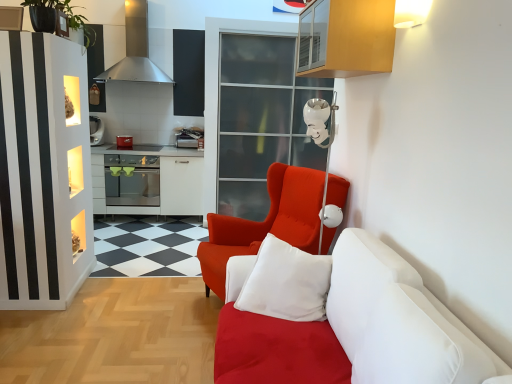
What is the approximate height of satin red armchair at center?

It is 39.01 inches.

The image size is (512, 384). What are the coordinates of `metallic oven at center-left, the second appliance when ordered from right to left` in the screenshot? It's located at (124, 141).

Describe the element at coordinates (124, 141) in the screenshot. I see `metallic oven at center-left, the second appliance when ordered from right to left` at that location.

Identify the location of satin silver oven at center. The image size is (512, 384). (132, 180).

This screenshot has height=384, width=512. In order to click on transparent glass door at upper center in this screenshot , I will do `click(261, 119)`.

Looking at this image, would you consider wooden cabinet at upper right to be distant from stainless steel exhaust hood at upper left?

Yes.

Would you say stainless steel exhaust hood at upper left is part of wooden cabinet at upper right's contents?

No, stainless steel exhaust hood at upper left is not a part of wooden cabinet at upper right.

Measure the distance between wooden cabinet at upper right and stainless steel exhaust hood at upper left.

wooden cabinet at upper right and stainless steel exhaust hood at upper left are 2.82 meters apart from each other.

Is wooden cabinet at upper right looking in the opposite direction of stainless steel exhaust hood at upper left?

No, wooden cabinet at upper right is not facing the opposite direction of stainless steel exhaust hood at upper left.

From the image's perspective, count 2nd appliances upward from the white fabric couch at lower right and point to it. Please provide its 2D coordinates.

[(186, 141)]

Is metallic silver toaster at center, marked as the second appliance in a left-to-right arrangement, spatially inside white fabric couch at lower right, or outside of it?

metallic silver toaster at center, marked as the second appliance in a left-to-right arrangement, is not enclosed by white fabric couch at lower right.

In terms of size, does metallic silver toaster at center, marked as the second appliance in a left-to-right arrangement, appear bigger or smaller than white fabric couch at lower right?

In the image, metallic silver toaster at center, marked as the second appliance in a left-to-right arrangement, appears to be smaller than white fabric couch at lower right.

Is there a large distance between green leafy plant at upper left and stainless steel oven at left?

Yes, green leafy plant at upper left is far from stainless steel oven at left.

How different are the orientations of green leafy plant at upper left and stainless steel oven at left in degrees?

There is a 2.96-degree angle between the facing directions of green leafy plant at upper left and stainless steel oven at left.

Which point is more forward, (73, 7) or (183, 199)?

Positioned in front is point (73, 7).

Consider the image. Is stainless steel oven at left located within green leafy plant at upper left?

Definitely not — stainless steel oven at left is not inside green leafy plant at upper left.

Which of these two, metallic silver toaster at center, which ranks as the 1th appliance in right-to-left order, or wooden cabinet at upper right, stands shorter?

metallic silver toaster at center, which ranks as the 1th appliance in right-to-left order, is shorter.

Could you measure the distance between metallic silver toaster at center, which ranks as the 1th appliance in right-to-left order, and wooden cabinet at upper right?

The distance of metallic silver toaster at center, which ranks as the 1th appliance in right-to-left order, from wooden cabinet at upper right is 2.68 meters.

Which object is further away from the camera, metallic silver toaster at center, which ranks as the 1th appliance in right-to-left order, or wooden cabinet at upper right?

metallic silver toaster at center, which ranks as the 1th appliance in right-to-left order, is behind.

Is metallic silver toaster at center, which ranks as the 1th appliance in right-to-left order, smaller than wooden cabinet at upper right?

Yes, metallic silver toaster at center, which ranks as the 1th appliance in right-to-left order, is smaller than wooden cabinet at upper right.

You are a GUI agent. You are given a task and a screenshot of the screen. Output one action in this format:
    pyautogui.click(x=<x>, y=<y>)
    Task: Click on the studio couch below the stainless steel exhaust hood at upper left (from a real-world perspective)
    This screenshot has width=512, height=384.
    Given the screenshot: What is the action you would take?
    pyautogui.click(x=371, y=328)

Is stainless steel exhaust hood at upper left looking in the opposite direction of white fabric couch at lower right?

stainless steel exhaust hood at upper left is not turned away from white fabric couch at lower right.

Considering the sizes of objects stainless steel exhaust hood at upper left and white fabric couch at lower right in the image provided, who is wider, stainless steel exhaust hood at upper left or white fabric couch at lower right?

white fabric couch at lower right.

Which point is more distant from viewer, (147, 68) or (408, 299)?

Positioned behind is point (147, 68).

In the scene shown: Which object is wider, wooden cabinet at upper right or green leafy plant at upper left?

Wider between the two is green leafy plant at upper left.

Considering the relative positions of wooden cabinet at upper right and green leafy plant at upper left in the image provided, is wooden cabinet at upper right to the right of green leafy plant at upper left from the viewer's perspective?

Yes.

Is point (330, 20) closer to camera compared to point (93, 35)?

Yes, point (330, 20) is in front of point (93, 35).

Can you see wooden cabinet at upper right touching green leafy plant at upper left?

No, wooden cabinet at upper right is not in contact with green leafy plant at upper left.

Is stainless steel oven at left positioned before metallic silver toaster at center, which ranks as the 1th appliance in right-to-left order?

Yes, the depth of stainless steel oven at left is less than that of metallic silver toaster at center, which ranks as the 1th appliance in right-to-left order.

Where is `table on the left of metallic silver toaster at center, which ranks as the 1th appliance in right-to-left order`? This screenshot has width=512, height=384. table on the left of metallic silver toaster at center, which ranks as the 1th appliance in right-to-left order is located at coordinates (150, 180).

From a real-world perspective, is stainless steel oven at left above or below metallic silver toaster at center, which ranks as the 1th appliance in right-to-left order?

stainless steel oven at left is below metallic silver toaster at center, which ranks as the 1th appliance in right-to-left order.

Between point (196, 183) and point (179, 141), which one is positioned behind?

The point (196, 183) is farther from the camera.

The image size is (512, 384). Identify the location of exhaust hood behind the wooden cabinet at upper right. (136, 50).

You are a GUI agent. You are given a task and a screenshot of the screen. Output one action in this format:
    pyautogui.click(x=<x>, y=<y>)
    Task: Click on the 1st appliance to the left when counting from the white fabric couch at lower right
    This screenshot has width=512, height=384.
    Given the screenshot: What is the action you would take?
    pyautogui.click(x=186, y=141)

Based on the photo, considering their positions, is transparent glass door at upper center positioned further to metallic silver toaster at center, which ranks as the 1th appliance in right-to-left order, than stainless steel exhaust hood at upper left?

Based on the image, stainless steel exhaust hood at upper left appears to be further to metallic silver toaster at center, which ranks as the 1th appliance in right-to-left order.

Considering their positions, is green leafy plant at upper left positioned closer to stainless steel oven at left than satin red armchair at center?

green leafy plant at upper left lies closer to stainless steel oven at left than the other object.

Considering their positions, is green leafy plant at upper left positioned closer to satin silver oven at center than white fabric couch at lower right?

green leafy plant at upper left is closer to satin silver oven at center.

Which object lies nearer to the anchor point white fabric couch at lower right, stainless steel exhaust hood at upper left or wooden cabinet at upper right?

Based on the image, wooden cabinet at upper right appears to be nearer to white fabric couch at lower right.

Looking at the image, which one is located closer to green leafy plant at upper left, stainless steel oven at left or wooden cabinet at upper right?

The object closer to green leafy plant at upper left is wooden cabinet at upper right.

Looking at the image, which one is located further to transparent glass door at upper center, stainless steel exhaust hood at upper left or white soft cushion at center?

white soft cushion at center lies further to transparent glass door at upper center than the other object.

Looking at this image, when comparing their distances from metallic oven at center-left, which is counted as the first appliance, starting from the left, does metallic silver toaster at center, which ranks as the 1th appliance in right-to-left order, or stainless steel oven at left seem further?

The object further to metallic oven at center-left, which is counted as the first appliance, starting from the left, is metallic silver toaster at center, which ranks as the 1th appliance in right-to-left order.

Based on their spatial positions, is metallic oven at center-left, which is counted as the first appliance, starting from the left, or green leafy plant at upper left further from stainless steel exhaust hood at upper left?

The object further to stainless steel exhaust hood at upper left is green leafy plant at upper left.

Where is `cabinetry positioned between white soft cushion at center and satin silver oven at center from near to far`? The image size is (512, 384). cabinetry positioned between white soft cushion at center and satin silver oven at center from near to far is located at coordinates (346, 38).

The height and width of the screenshot is (384, 512). I want to click on cabinetry located between white fabric couch at lower right and stainless steel oven at left in the depth direction, so click(x=346, y=38).

Locate an element on the screen. appliance that lies between stainless steel exhaust hood at upper left and metallic oven at center-left, the second appliance when ordered from right to left, from top to bottom is located at coordinates (186, 141).

Where is `table between white fabric couch at lower right and metallic silver toaster at center, which ranks as the 1th appliance in right-to-left order, from front to back`? This screenshot has height=384, width=512. table between white fabric couch at lower right and metallic silver toaster at center, which ranks as the 1th appliance in right-to-left order, from front to back is located at coordinates (150, 180).